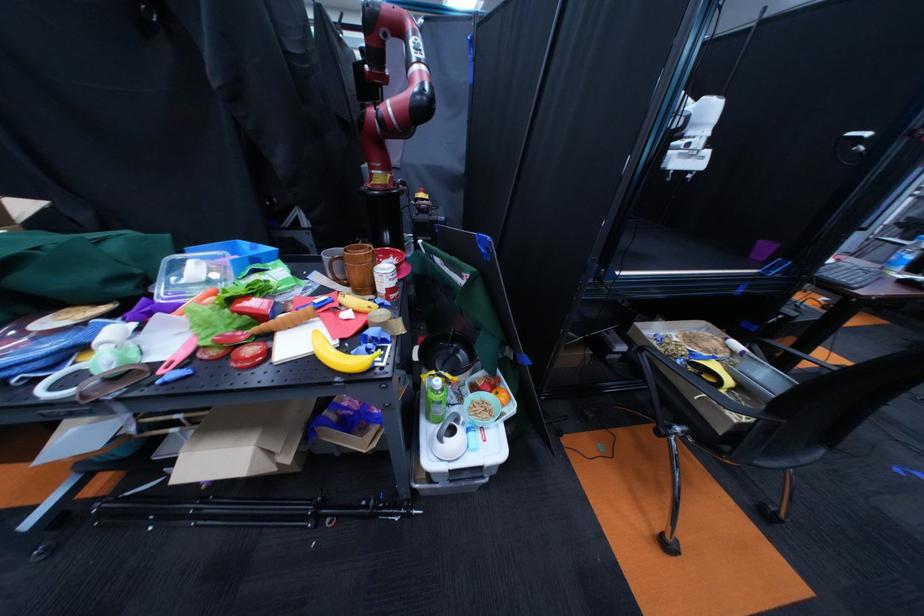
This screenshot has width=924, height=616. Describe the element at coordinates (357, 268) in the screenshot. I see `the wooden mug handle` at that location.